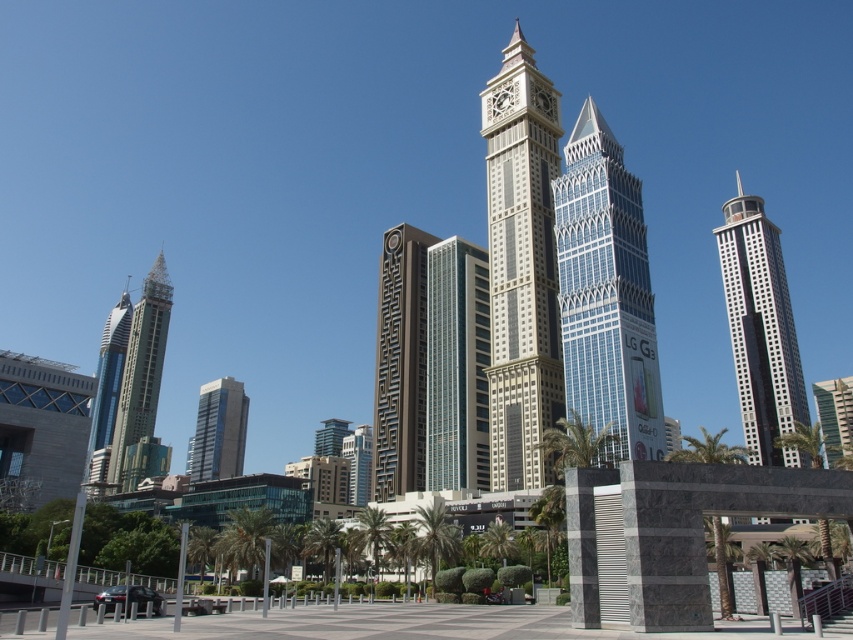
Who is lower down, white glass tower at right or green glass building at center?

green glass building at center is lower down.

Can you confirm if white glass tower at right is shorter than green glass building at center?

No.

You are a GUI agent. You are given a task and a screenshot of the screen. Output one action in this format:
    pyautogui.click(x=<x>, y=<y>)
    Task: Click on the white glass tower at right
    The image size is (853, 640).
    Given the screenshot: What is the action you would take?
    pyautogui.click(x=759, y=330)

You are a GUI agent. You are given a task and a screenshot of the screen. Output one action in this format:
    pyautogui.click(x=<x>, y=<y>)
    Task: Click on the white glass tower at right
    The image size is (853, 640).
    Given the screenshot: What is the action you would take?
    pyautogui.click(x=759, y=330)

Between blue glass skyscraper at left and metallic glass building at center, which one appears on the right side from the viewer's perspective?

From the viewer's perspective, metallic glass building at center appears more on the right side.

Which is behind, point (108, 380) or point (355, 500)?

The point (108, 380) is more distant.

Is point (125, 339) more distant than point (352, 440)?

Yes, point (125, 339) is behind point (352, 440).

At what (x,y) coordinates should I click in order to perform the action: click on blue glass skyscraper at left. Please return your answer as a coordinate pair (x, y). This screenshot has height=640, width=853. Looking at the image, I should click on pyautogui.click(x=107, y=390).

Does blue glass skyscraper at center have a greater height compared to blue glass skyscraper at left?

In fact, blue glass skyscraper at center may be shorter than blue glass skyscraper at left.

Is blue glass skyscraper at center further to the viewer compared to blue glass skyscraper at left?

Yes, it is behind blue glass skyscraper at left.

Measure the distance between point [206,429] and camera.

The distance of point [206,429] from camera is 188.18 meters.

Where is `blue glass skyscraper at center`? This screenshot has height=640, width=853. blue glass skyscraper at center is located at coordinates (218, 429).